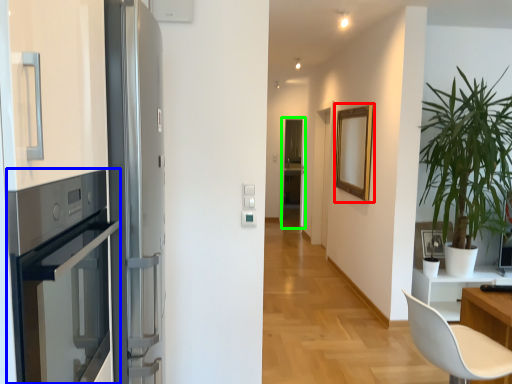
Question: Based on their relative distances, which object is nearer to picture frame (highlighted by a red box)? Choose from oven (highlighted by a blue box) and screen door (highlighted by a green box).

Choices:
 (A) oven
 (B) screen door

Answer: (B)